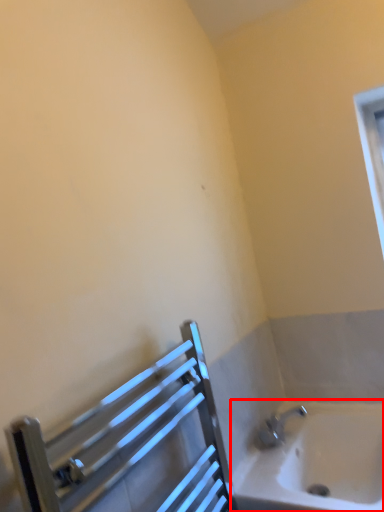
Question: Considering the relative positions of bathtub (annotated by the red box) and balustrade in the image provided, where is bathtub (annotated by the red box) located with respect to the staircase?

Choices:
 (A) right
 (B) left

Answer: (A)